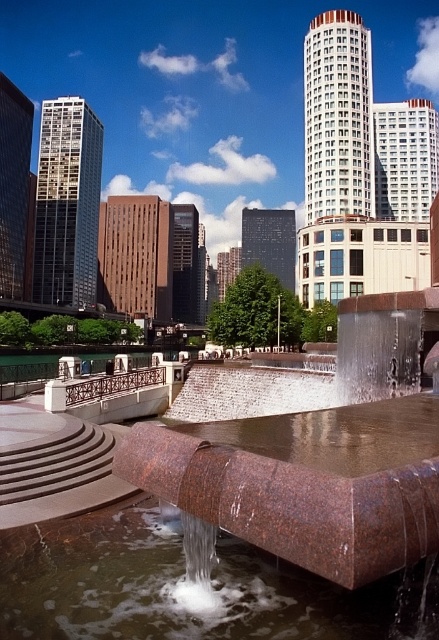
Which is below, rustic stone fountain at center or brown granite water at center?

brown granite water at center

Can you confirm if rustic stone fountain at center is positioned to the right of brown granite water at center?

Yes, rustic stone fountain at center is to the right of brown granite water at center.

Who is more distant from viewer, (410, 445) or (416, 586)?

Positioned behind is point (416, 586).

Locate an element on the screen. rustic stone fountain at center is located at coordinates (244, 529).